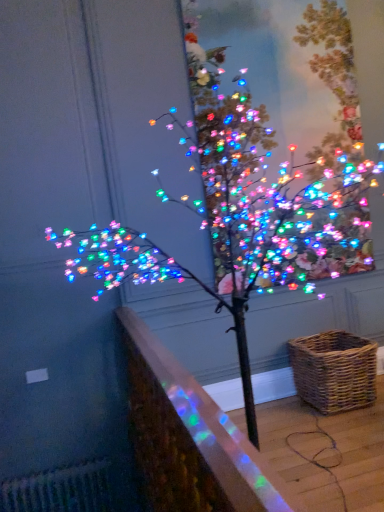
Question: Is multicolored lights at upper center outside of translucent glass railing at lower left?

Choices:
 (A) no
 (B) yes

Answer: (B)

Question: Does multicolored lights at upper center lie behind translucent glass railing at lower left?

Choices:
 (A) yes
 (B) no

Answer: (A)

Question: Is translucent glass railing at lower left located within multicolored lights at upper center?

Choices:
 (A) no
 (B) yes

Answer: (A)

Question: Does multicolored lights at upper center have a greater width compared to translucent glass railing at lower left?

Choices:
 (A) no
 (B) yes

Answer: (A)

Question: Is multicolored lights at upper center positioned far away from translucent glass railing at lower left?

Choices:
 (A) yes
 (B) no

Answer: (A)

Question: From a real-world perspective, is woven brown picnic basket at lower right physically located above or below translucent glass railing at lower left?

Choices:
 (A) above
 (B) below

Answer: (B)

Question: Is woven brown picnic basket at lower right wider or thinner than translucent glass railing at lower left?

Choices:
 (A) thin
 (B) wide

Answer: (B)

Question: Would you say woven brown picnic basket at lower right is inside or outside translucent glass railing at lower left?

Choices:
 (A) inside
 (B) outside

Answer: (B)

Question: Considering the positions of point (347, 381) and point (233, 425), is point (347, 381) closer or farther from the camera than point (233, 425)?

Choices:
 (A) farther
 (B) closer

Answer: (A)

Question: In the image, is multicolored lights at upper center positioned in front of or behind translucent glass railing at lower left?

Choices:
 (A) front
 (B) behind

Answer: (B)

Question: Considering the positions of point (231, 259) and point (173, 394), is point (231, 259) closer or farther from the camera than point (173, 394)?

Choices:
 (A) closer
 (B) farther

Answer: (B)

Question: Choose the correct answer: Is multicolored lights at upper center inside translucent glass railing at lower left or outside it?

Choices:
 (A) outside
 (B) inside

Answer: (A)

Question: Would you say multicolored lights at upper center is to the left or to the right of translucent glass railing at lower left in the picture?

Choices:
 (A) right
 (B) left

Answer: (A)

Question: Looking at the image, does multicolored lights at upper center seem bigger or smaller compared to woven brown picnic basket at lower right?

Choices:
 (A) big
 (B) small

Answer: (A)

Question: Would you say multicolored lights at upper center is inside or outside woven brown picnic basket at lower right?

Choices:
 (A) inside
 (B) outside

Answer: (B)